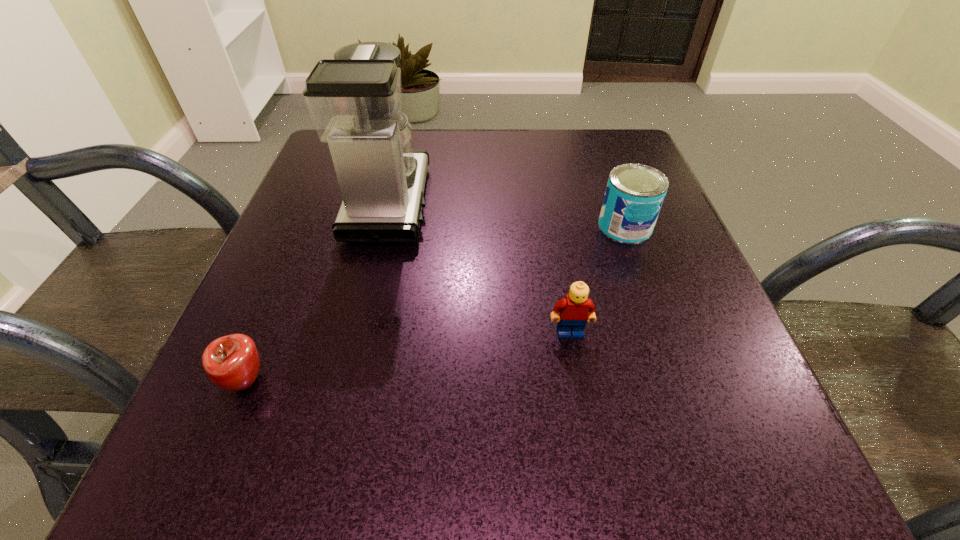
In the image, there is a desktop. Where is `blank space at the near left corner`? The height and width of the screenshot is (540, 960). blank space at the near left corner is located at coordinates (200, 502).

Identify the location of vacant region at the far right corner of the desktop. Image resolution: width=960 pixels, height=540 pixels. (621, 129).

This screenshot has width=960, height=540. Find the location of `free point between the third object from right to left and the can`. free point between the third object from right to left and the can is located at coordinates (507, 215).

I want to click on free point between the third object from right to left and the Lego, so click(479, 267).

Find the location of a particular element. Image resolution: width=960 pixels, height=540 pixels. free spot between the apple and the tallest object is located at coordinates (318, 292).

The image size is (960, 540). What are the coordinates of `free space between the shortest object and the can` in the screenshot? It's located at (435, 304).

Locate an element on the screen. Image resolution: width=960 pixels, height=540 pixels. free area in between the nearest object and the tallest object is located at coordinates (318, 292).

I want to click on vacant space in between the nearest object and the coffee maker, so click(x=318, y=292).

This screenshot has height=540, width=960. Find the location of `free spot between the coffee maker and the leftmost object`. free spot between the coffee maker and the leftmost object is located at coordinates click(318, 292).

Locate an element on the screen. The width and height of the screenshot is (960, 540). free space between the tallest object and the shortest object is located at coordinates (318, 292).